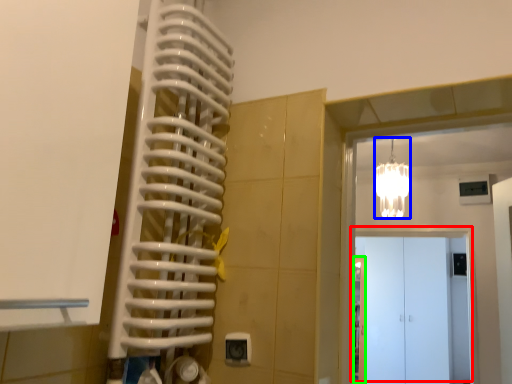
Question: Which object is the farthest from door (highlighted by a red box)? Choose among these: light fixture (highlighted by a blue box) or door (highlighted by a green box).

Choices:
 (A) light fixture
 (B) door

Answer: (A)